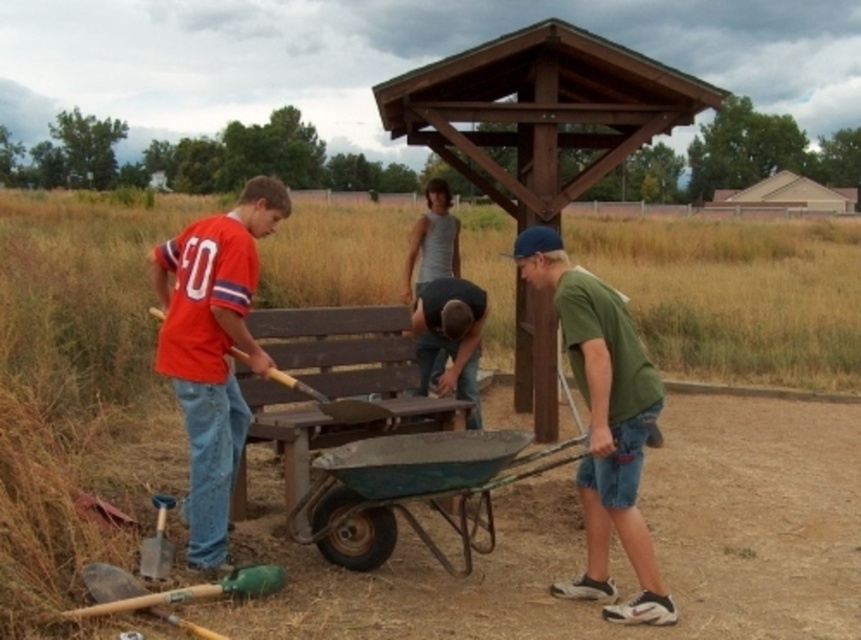
Does green metal wheelbarrow at center appear over gray tank top at center?

No.

Looking at this image, can you confirm if green metal wheelbarrow at center is taller than gray tank top at center?

Incorrect, green metal wheelbarrow at center's height is not larger of gray tank top at center's.

Describe the element at coordinates (412, 490) in the screenshot. The image size is (861, 640). I see `green metal wheelbarrow at center` at that location.

Image resolution: width=861 pixels, height=640 pixels. I want to click on green metal wheelbarrow at center, so click(412, 490).

From the picture: Does matte red shirt at left have a smaller size compared to wooden shovel at center?

No.

Between matte red shirt at left and wooden shovel at center, which one appears on the right side from the viewer's perspective?

From the viewer's perspective, wooden shovel at center appears more on the right side.

The width and height of the screenshot is (861, 640). In order to click on matte red shirt at left in this screenshot , I will do `click(214, 352)`.

Is matte red shirt at left taller than gray tank top at center?

Yes.

Does matte red shirt at left lie in front of gray tank top at center?

That is True.

The height and width of the screenshot is (640, 861). Describe the element at coordinates (214, 352) in the screenshot. I see `matte red shirt at left` at that location.

In order to click on matte red shirt at left in this screenshot , I will do `click(214, 352)`.